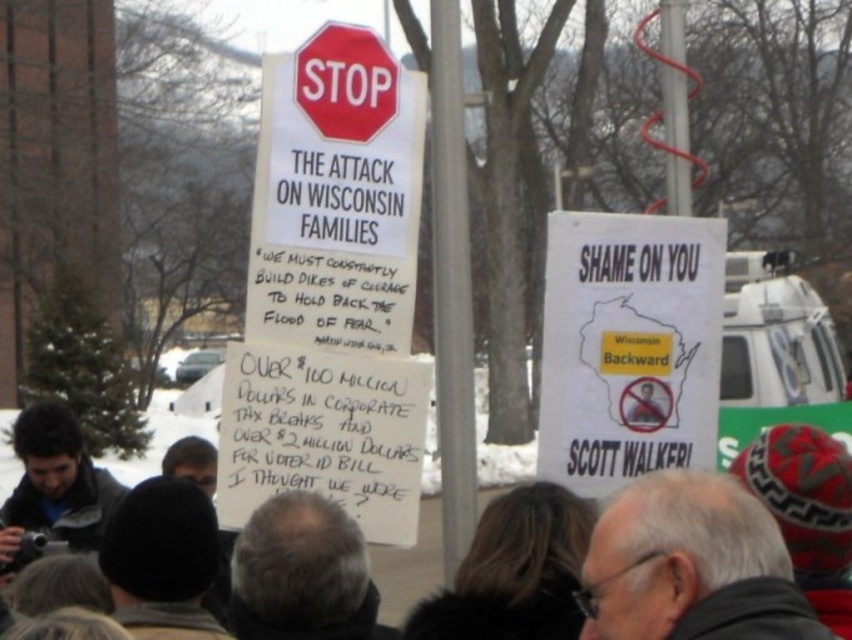
Question: Can you confirm if white paper poster at center right is smaller than gray hair at upper right?

Choices:
 (A) no
 (B) yes

Answer: (A)

Question: Among these objects, which one is nearest to the camera?

Choices:
 (A) white paper poster at center right
 (B) dark gray knit hat at center

Answer: (B)

Question: Does white paper poster at center right have a larger size compared to dark gray knit hat at center?

Choices:
 (A) yes
 (B) no

Answer: (B)

Question: Observing the image, what is the correct spatial positioning of dark gray knit hat at center in reference to red glossy stop sign at upper center?

Choices:
 (A) below
 (B) above

Answer: (A)

Question: Which of these objects is positioned closest to the white paper poster at center right?

Choices:
 (A) dark gray knit hat at center
 (B) gray hair at upper right
 (C) dark gray jacket at lower left

Answer: (C)

Question: Which of the following is the closest to the observer?

Choices:
 (A) (111, 512)
 (B) (406, 579)
 (C) (648, 630)

Answer: (C)